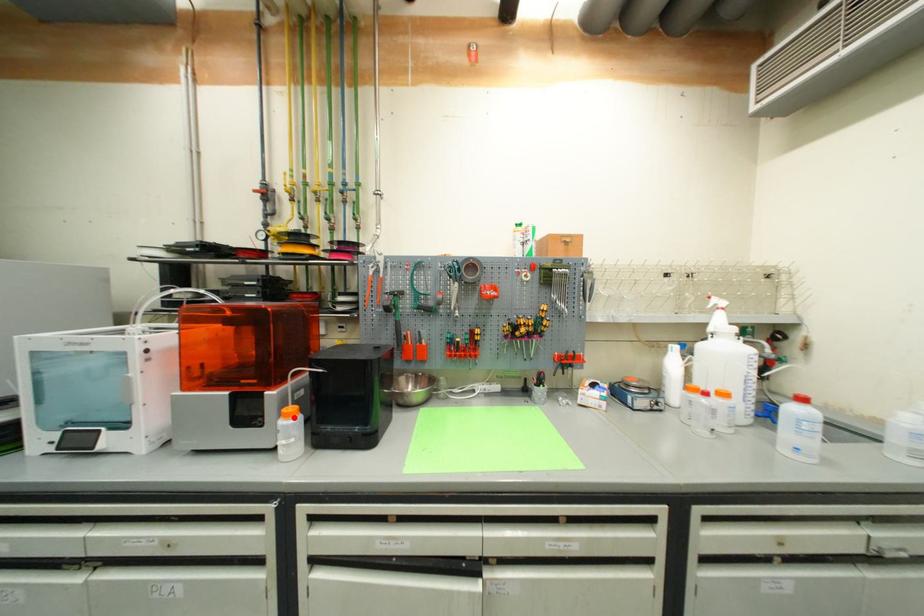
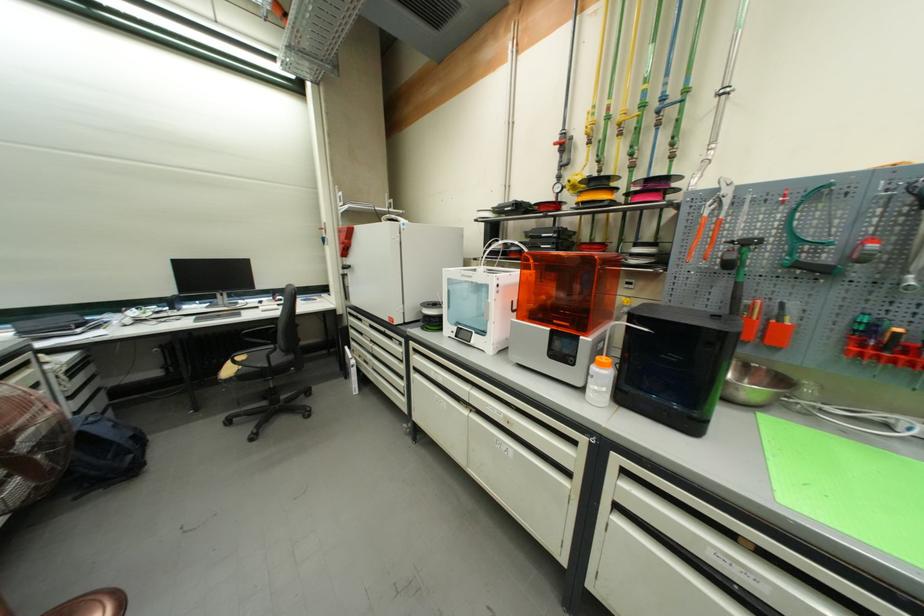
The point at the highlighted location is marked in the first image. Where is the corresponding point in the second image?

(606, 367)